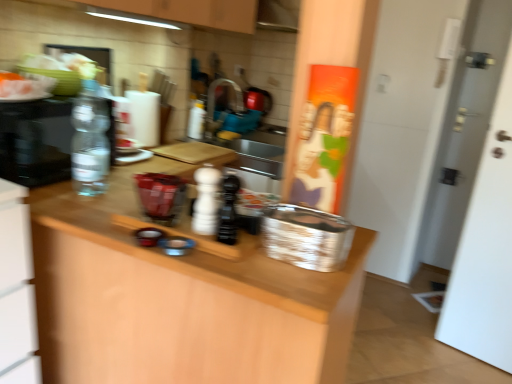
Question: Is the position of translucent plastic bottle at center, acting as the first bottle starting from the back, less distant than that of transparent plastic bottle at left, which ranks as the 1th bottle in left-to-right order?

Choices:
 (A) no
 (B) yes

Answer: (A)

Question: Does translucent plastic bottle at center, acting as the first bottle starting from the back, turn towards transparent plastic bottle at left, which is the 2th bottle from back to front?

Choices:
 (A) yes
 (B) no

Answer: (B)

Question: Does translucent plastic bottle at center, acting as the first bottle starting from the back, have a smaller size compared to transparent plastic bottle at left, acting as the third bottle starting from the front?

Choices:
 (A) yes
 (B) no

Answer: (A)

Question: Is transparent plastic bottle at left, acting as the third bottle starting from the front, inside translucent plastic bottle at center, marked as the 4th bottle in a front-to-back arrangement?

Choices:
 (A) no
 (B) yes

Answer: (A)

Question: Can you confirm if translucent plastic bottle at center, acting as the first bottle starting from the back, is shorter than transparent plastic bottle at left, acting as the third bottle starting from the front?

Choices:
 (A) no
 (B) yes

Answer: (B)

Question: Is the surface of translucent plastic bottle at center, which appears as the second bottle when viewed from the left, in direct contact with transparent plastic bottle at left, which is the 4th bottle from right to left?

Choices:
 (A) no
 (B) yes

Answer: (A)

Question: From a real-world perspective, is clear glass water bottle at left physically above wooden at center?

Choices:
 (A) yes
 (B) no

Answer: (A)

Question: Does clear glass water bottle at left have a lesser height compared to wooden at center?

Choices:
 (A) yes
 (B) no

Answer: (A)

Question: Considering the relative sizes of clear glass water bottle at left and wooden at center in the image provided, is clear glass water bottle at left bigger than wooden at center?

Choices:
 (A) yes
 (B) no

Answer: (B)

Question: Is the position of clear glass water bottle at left more distant than that of wooden at center?

Choices:
 (A) yes
 (B) no

Answer: (A)

Question: Can you confirm if clear glass water bottle at left is taller than wooden at center?

Choices:
 (A) no
 (B) yes

Answer: (A)

Question: Is clear glass water bottle at left thinner than wooden at center?

Choices:
 (A) yes
 (B) no

Answer: (A)

Question: From a real-world perspective, is transparent plastic bottle at left, which ranks as the 1th bottle in left-to-right order, physically below white matte pepper shaker at center, the second bottle positioned from the right?

Choices:
 (A) yes
 (B) no

Answer: (B)